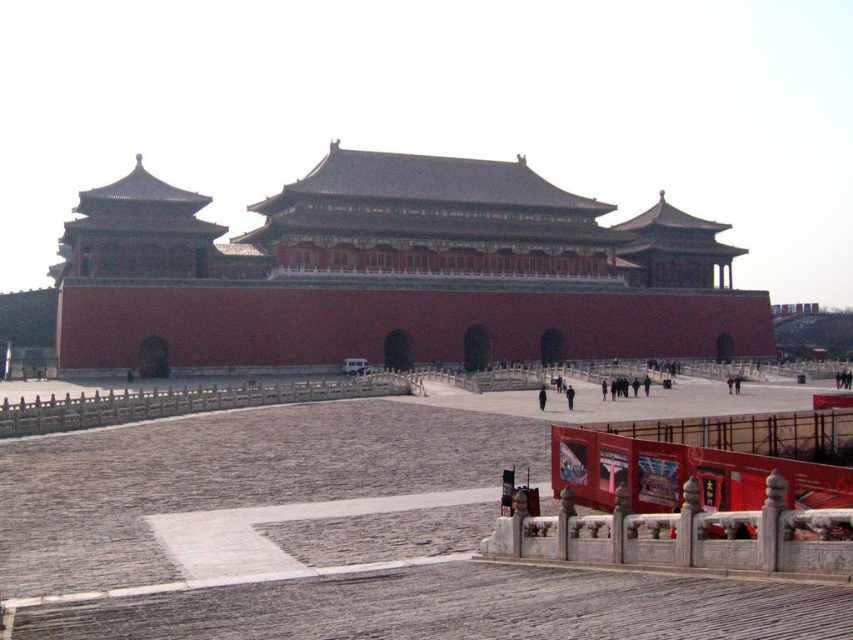
Question: Where is gray stone plaza at center located in relation to black fabric person at center in the image?

Choices:
 (A) below
 (B) above

Answer: (B)

Question: Which is farther from the smooth red wall at center?

Choices:
 (A) dark blue fabric at center
 (B) gray stone plaza at center
 (C) black fabric person at center

Answer: (B)

Question: Is smooth red wall at center bigger than black fabric person at center?

Choices:
 (A) yes
 (B) no

Answer: (A)

Question: Which of the following is the closest to the observer?

Choices:
 (A) gray stone plaza at center
 (B) black fabric person at center
 (C) smooth red wall at center
 (D) dark blue fabric at center

Answer: (A)

Question: Which object is positioned farthest from the dark blue fabric at center?

Choices:
 (A) gray stone plaza at center
 (B) smooth red wall at center

Answer: (B)

Question: Where is smooth red wall at center located in relation to dark blue fabric at center in the image?

Choices:
 (A) below
 (B) above

Answer: (B)